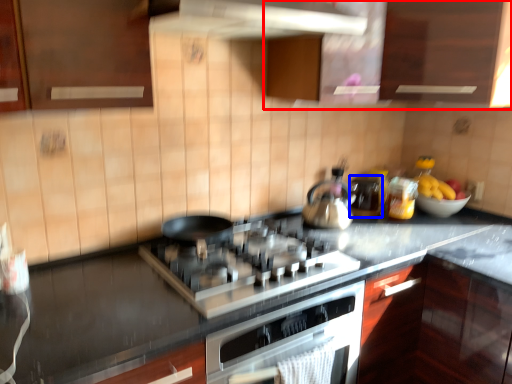
Question: Which object appears farthest to the camera in this image, cabinetry (highlighted by a red box) or appliance (highlighted by a blue box)?

Choices:
 (A) cabinetry
 (B) appliance

Answer: (B)